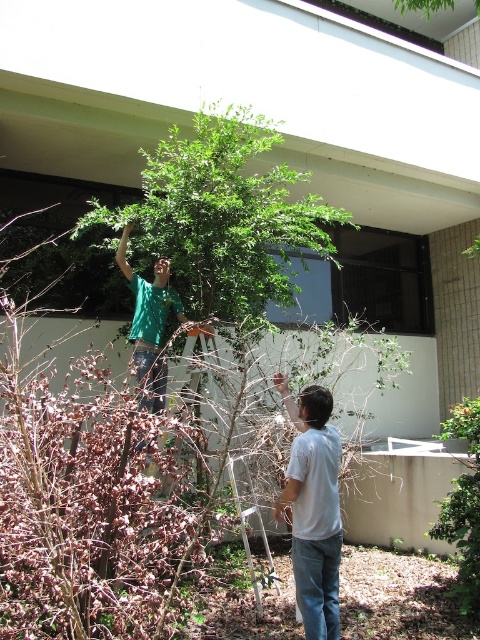
You are standing in front of the garden scene. There are two points marked in the image. The first point is at coordinates point (298, 525) and the second point is at point (182, 378). Which of these two points is nearer to you?

Point (298, 525) is closer to the camera than point (182, 378), so the first point is nearer to you.